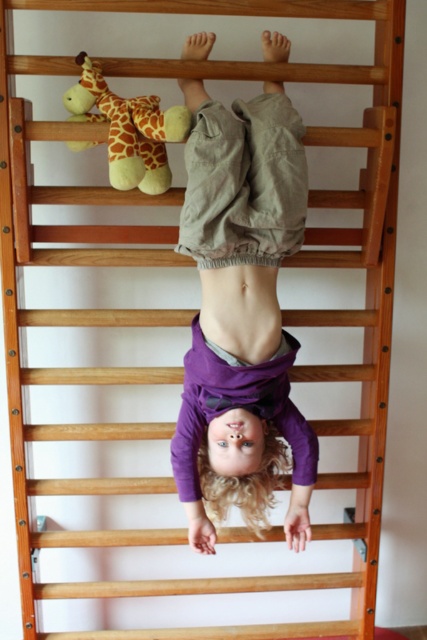
Question: Can you confirm if purple cotton shirt at center is bigger than soft plush giraffe at upper center?

Choices:
 (A) no
 (B) yes

Answer: (B)

Question: Which point is closer to the camera?

Choices:
 (A) purple cotton shirt at center
 (B) soft plush giraffe at upper center

Answer: (A)

Question: Can you confirm if purple cotton shirt at center is thinner than soft plush giraffe at upper center?

Choices:
 (A) yes
 (B) no

Answer: (B)

Question: In this image, where is purple cotton shirt at center located relative to soft plush giraffe at upper center?

Choices:
 (A) left
 (B) right

Answer: (B)